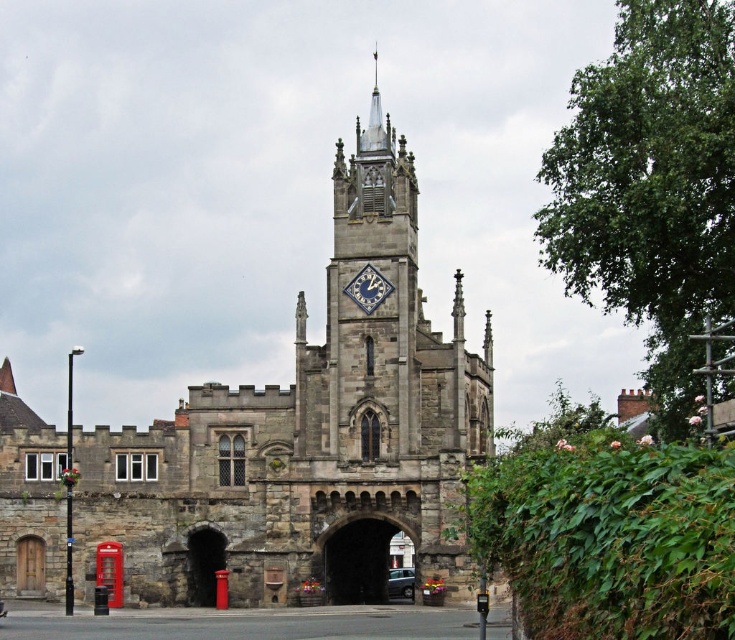
You are a driver approaching the historic stone structure. You see the stone church at center and the metallic gray car at center. Which object is positioned higher from the ground?

The stone church at center is above the metallic gray car at center, so the stone church at center is positioned higher from the ground.

You are a tourist standing in front of the historic stone structure and want to take a photo that includes both the stone church at center and the metallic gray car at center. Given their sizes, which one will appear bigger in the photo?

The stone church at center is larger in size than the metallic gray car at center, so it will appear bigger in the photo.